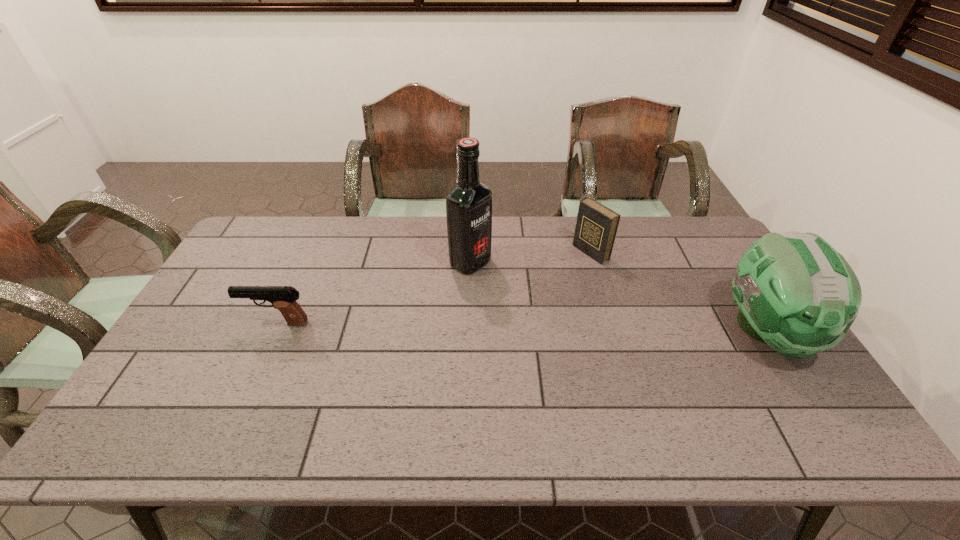
Where is `pistol`? pistol is located at coordinates [283, 298].

The height and width of the screenshot is (540, 960). I want to click on the shortest object, so click(283, 298).

At what (x,y) coordinates should I click in order to perform the action: click on football helmet. Please return your answer as a coordinate pair (x, y). Looking at the image, I should click on click(796, 293).

The image size is (960, 540). In order to click on the third shortest object in this screenshot , I will do `click(796, 293)`.

Where is `the third object from left to right`? The width and height of the screenshot is (960, 540). the third object from left to right is located at coordinates (596, 226).

Locate an element on the screen. This screenshot has height=540, width=960. the third tallest object is located at coordinates (596, 226).

Find the location of `the tallest object`. the tallest object is located at coordinates (469, 204).

Where is `the second object from left to right`? The width and height of the screenshot is (960, 540). the second object from left to right is located at coordinates (469, 204).

In order to click on vacant space situated 0.090m at the barrel of the shortest object in this screenshot , I will do `click(213, 323)`.

Find the location of a particular element. The image size is (960, 540). free region located at the barrel of the shortest object is located at coordinates (189, 323).